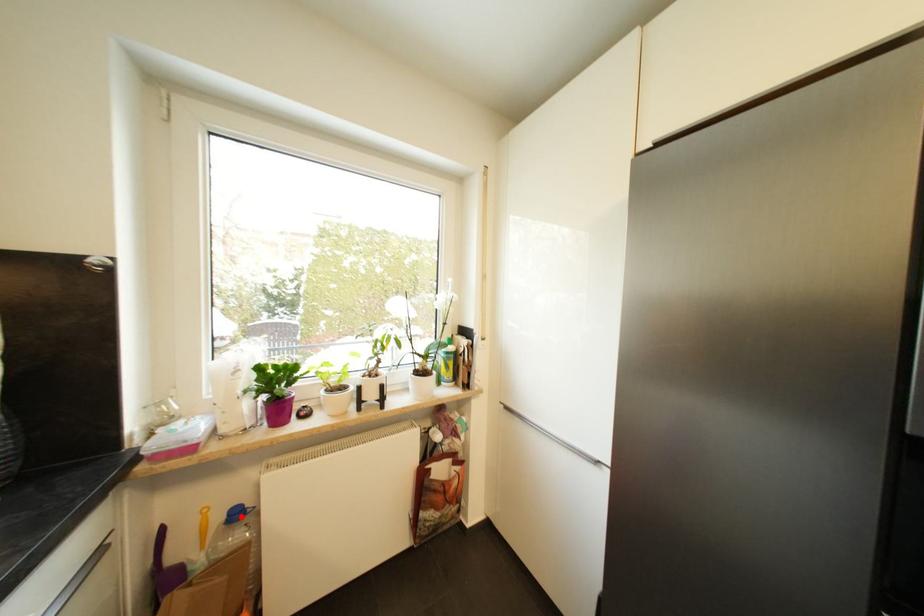
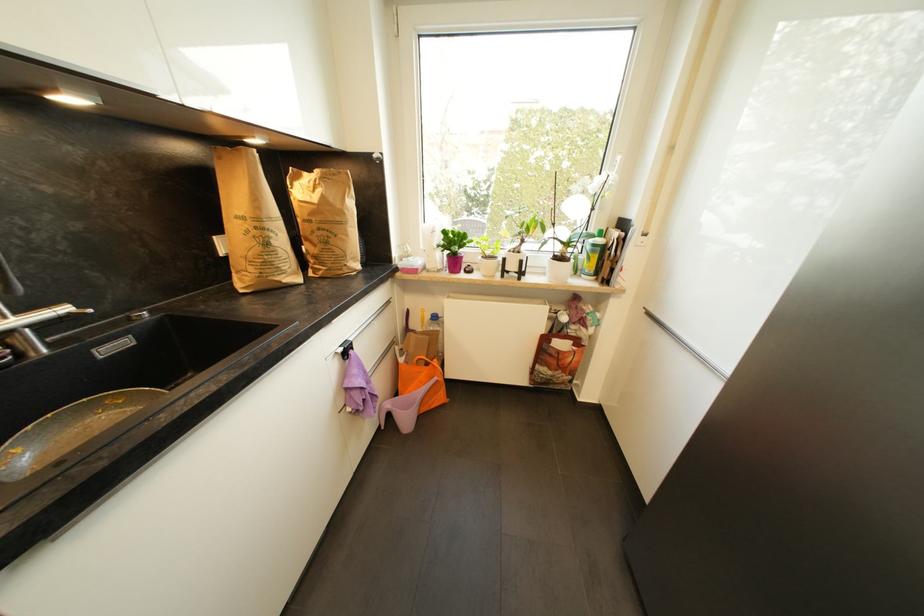
Question: I am providing you with two images of the same scene from different viewpoints. Given a red point in image1, look at the same physical point in image2. Is it:

Choices:
 (A) Closer to the viewpoint
 (B) Farther from the viewpoint

Answer: (A)